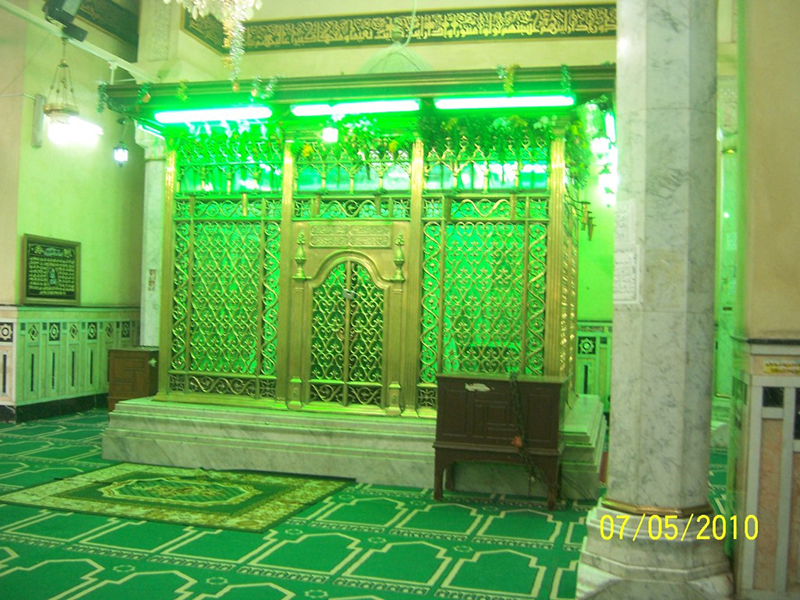
Find the location of a particular element. Image resolution: width=800 pixels, height=600 pixels. picture is located at coordinates (49, 267).